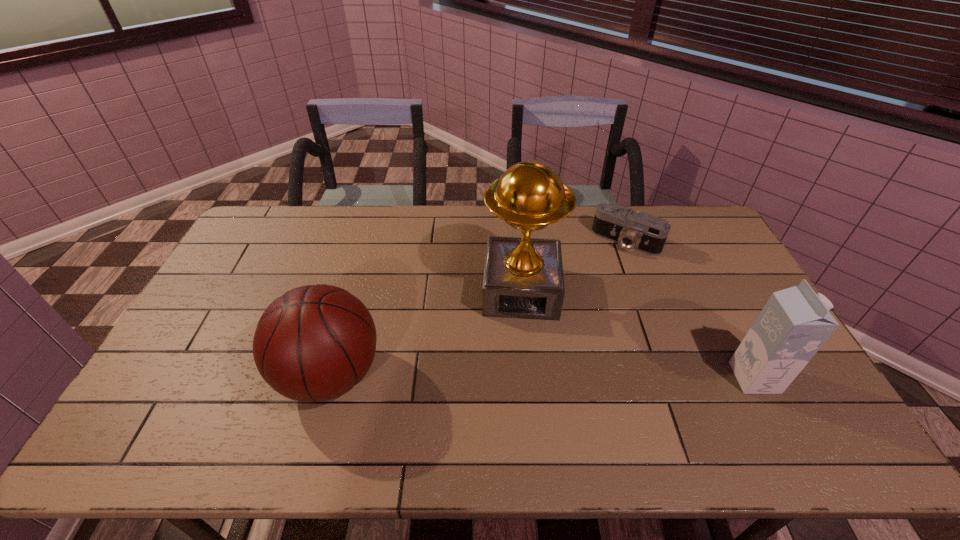
Identify the location of vacant spot on the desktop that is between the leftmost object and the rightmost object and is positioned on the front-facing side of the tallest object. (520, 376).

Locate an element on the screen. The image size is (960, 540). free space on the desktop that is between the leftmost object and the carton and is positioned on the lens of the camera is located at coordinates pos(541,376).